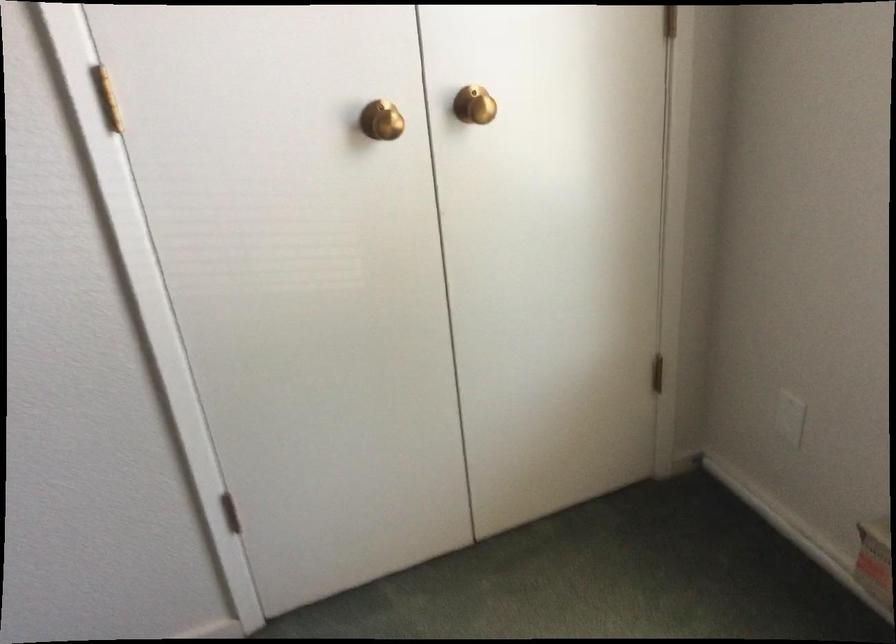
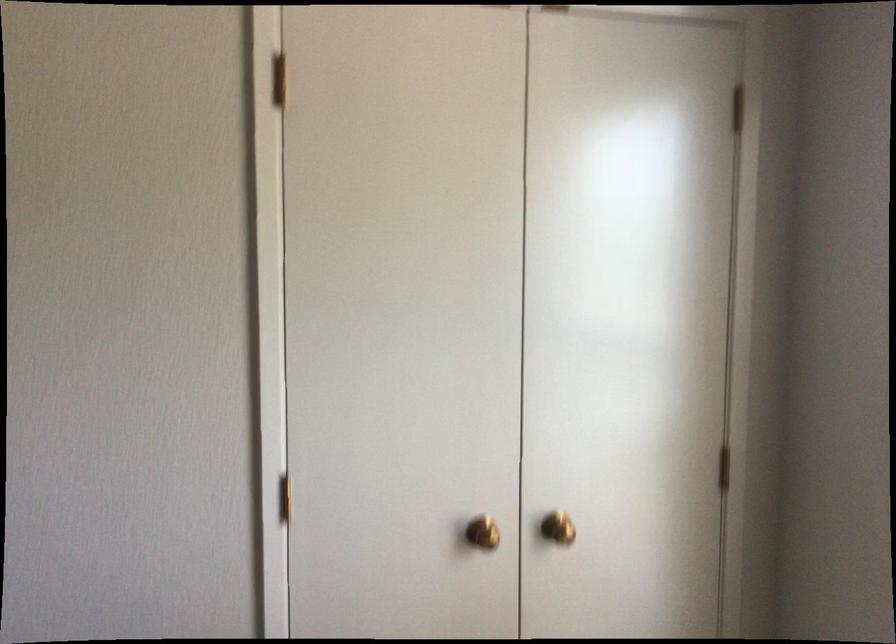
Find the pixel in the second image that matches (485,82) in the first image.

(557, 527)